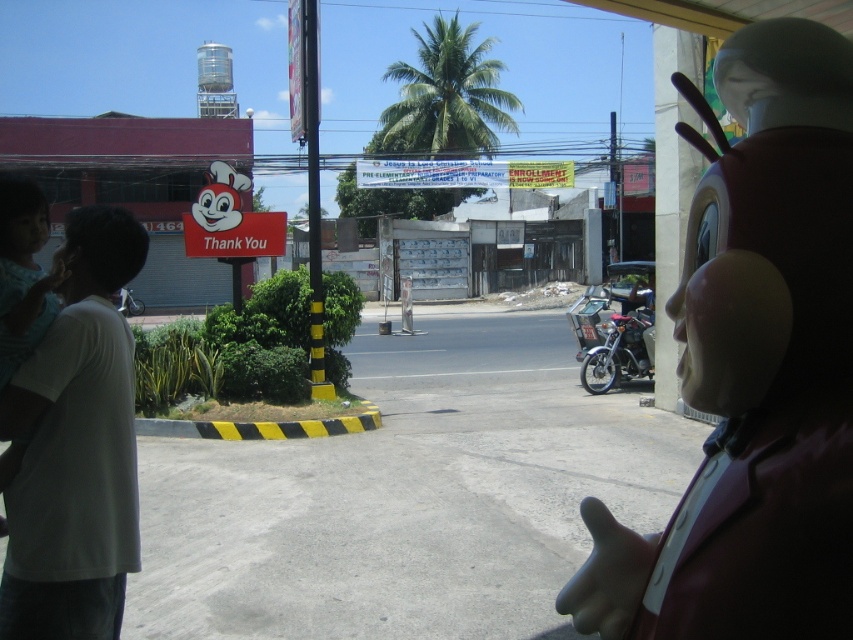
You are a photographer standing in the middle of the street. You want to take a photo of both the white cotton shirt at left and the metallic silver motorcycle at right. Can you frame both objects in the same shot without moving your position? Explain why or why not based on their positions.

The white cotton shirt at left is positioned under the metallic silver motorcycle at right, meaning the motorcycle is above the shirt in the frame. Since both are in different vertical positions but on opposite sides horizontally, you can likely include both in the same shot by adjusting the camera angle to capture the shirt on the lower left and the motorcycle on the upper right.

You are standing in the street scene and want to place a small flowerpot between the two points labeled as point (769, 244) and point (99, 432). Which point should the flowerpot be closer to in order to be nearer to the viewer?

The flowerpot should be placed closer to point (769, 244) because it is closer to the viewer than point (99, 432).

You are a delivery person who needs to park your motorcycle. You see the smooth brown statue at right and the metallic silver motorcycle at right. Can you park your motorcycle next to the statue without blocking the sidewalk?

Result: The smooth brown statue at right is above the metallic silver motorcycle at right, so there is space below the statue to park the motorcycle without blocking the sidewalk.